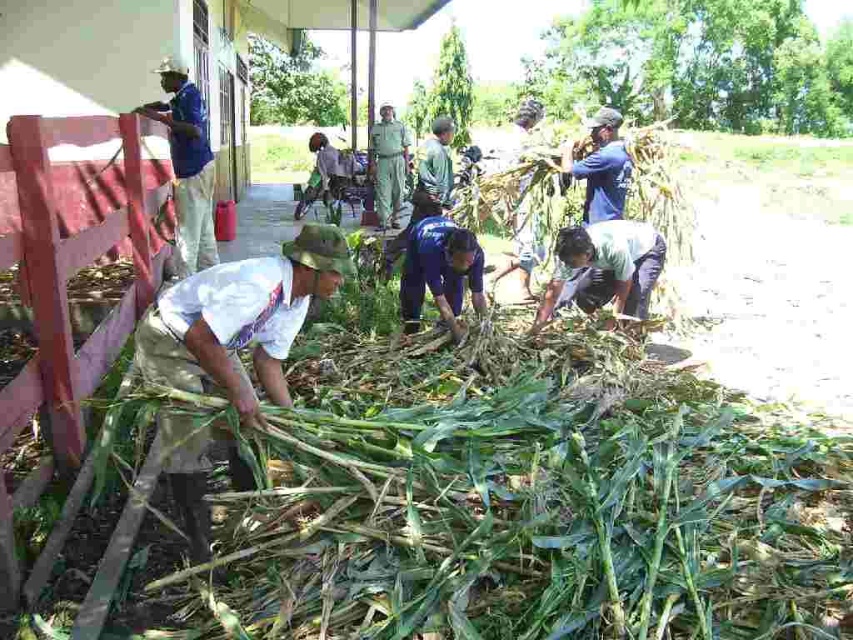
Question: Is the position of blue uniform at center less distant than that of blue fabric cap at upper right?

Choices:
 (A) yes
 (B) no

Answer: (A)

Question: Which point is closer to the camera?

Choices:
 (A) (444, 125)
 (B) (405, 129)

Answer: (A)

Question: Can you confirm if blue uniform at center is positioned above green fabric shirt at center?

Choices:
 (A) no
 (B) yes

Answer: (A)

Question: Does blue fabric shirt at upper left appear over green fabric shirt at center?

Choices:
 (A) yes
 (B) no

Answer: (B)

Question: Which object is the farthest from the blue fabric shirt at upper left?

Choices:
 (A) green uniform at center
 (B) white fabric shirt at center
 (C) green fabric shirt at center
 (D) blue uniform at center

Answer: (A)

Question: Which point is closer to the camera taking this photo?

Choices:
 (A) (593, 184)
 (B) (648, 225)
 (C) (229, 301)
 (D) (380, 209)

Answer: (C)